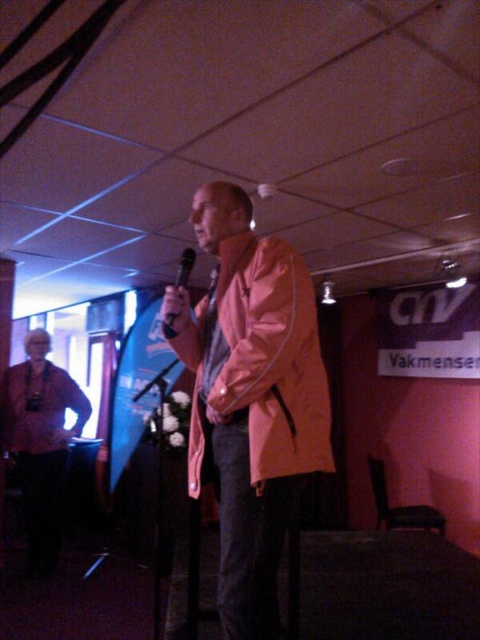
Question: Which point is closer to the camera?

Choices:
 (A) black matte microphone at center
 (B) orange matte jacket at center

Answer: (B)

Question: Is orange matte jacket at center bigger than black matte microphone at center?

Choices:
 (A) yes
 (B) no

Answer: (A)

Question: Can you confirm if orange matte jacket at center is positioned below black matte microphone at center?

Choices:
 (A) yes
 (B) no

Answer: (A)

Question: Which object is farther from the camera taking this photo?

Choices:
 (A) orange matte jacket at center
 (B) black matte microphone at center

Answer: (B)

Question: Does orange matte jacket at center have a larger size compared to black matte microphone at center?

Choices:
 (A) no
 (B) yes

Answer: (B)